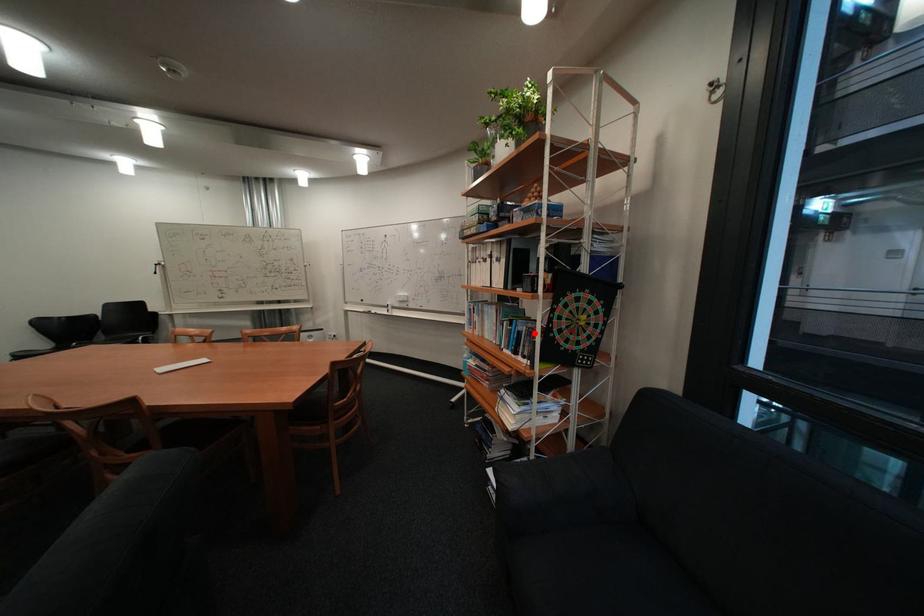
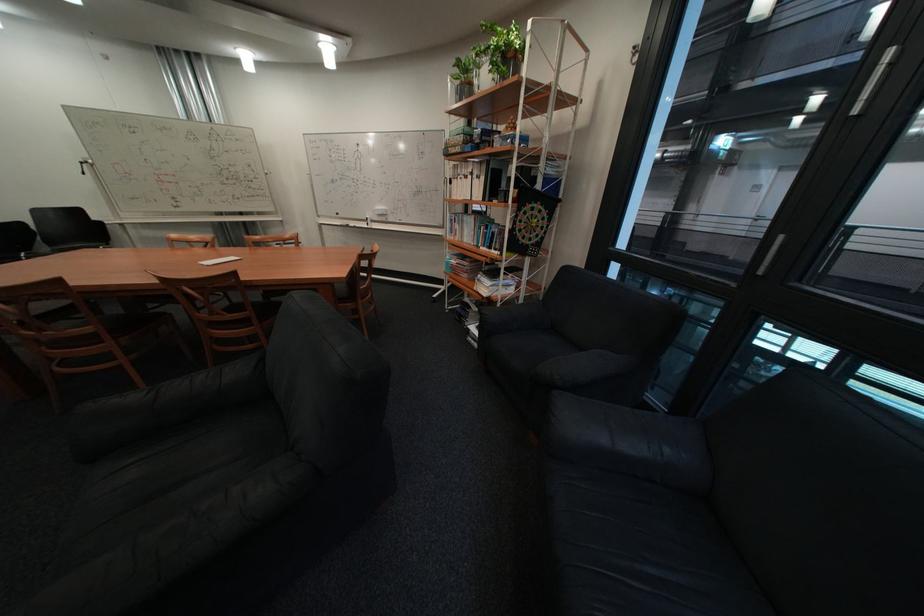
In the second image, find the point that corresponds to the highlighted location in the first image.

(508, 233)